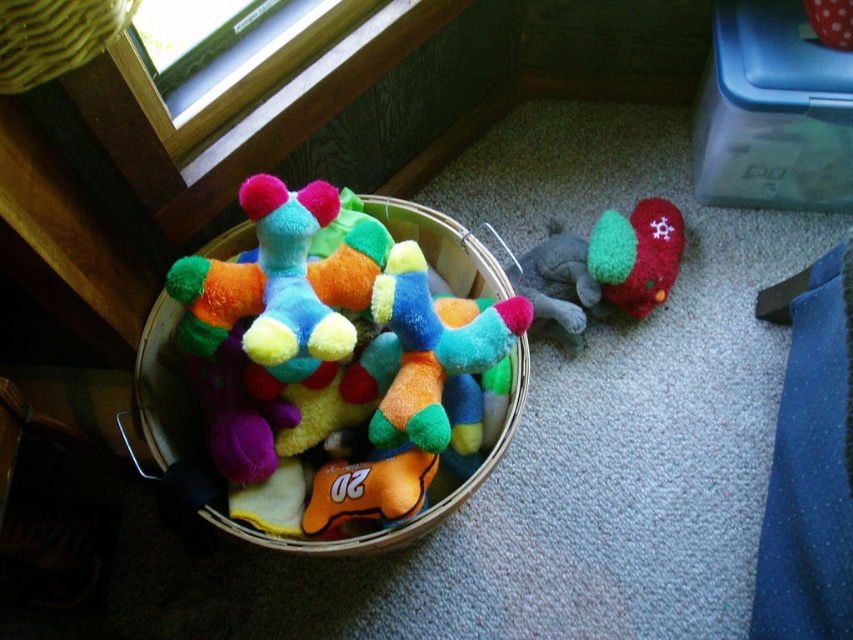
How far apart are soft fabric stuffed animals at center and velvety green plush toy at lower right?

soft fabric stuffed animals at center and velvety green plush toy at lower right are 39.46 centimeters apart from each other.

Can you confirm if soft fabric stuffed animals at center is positioned below velvety green plush toy at lower right?

Correct, soft fabric stuffed animals at center is located below velvety green plush toy at lower right.

Which is behind, point (440, 225) or point (642, 202)?

Positioned behind is point (642, 202).

This screenshot has width=853, height=640. In order to click on soft fabric stuffed animals at center in this screenshot , I will do `click(410, 518)`.

Between soft fabric stuffed animals at center and yellow woven basket at upper left, which one appears on the right side from the viewer's perspective?

soft fabric stuffed animals at center is more to the right.

Between point (358, 198) and point (10, 52), which one is positioned behind?

Positioned behind is point (358, 198).

Where is `soft fabric stuffed animals at center`? soft fabric stuffed animals at center is located at coordinates (410, 518).

The image size is (853, 640). What do you see at coordinates (55, 36) in the screenshot?
I see `yellow woven basket at upper left` at bounding box center [55, 36].

Is yellow woven basket at upper left above velvety green plush toy at lower right?

Yes.

Between point (24, 51) and point (640, 269), which one is positioned behind?

The point (640, 269) is behind.

Where is `yellow woven basket at upper left`? yellow woven basket at upper left is located at coordinates (55, 36).